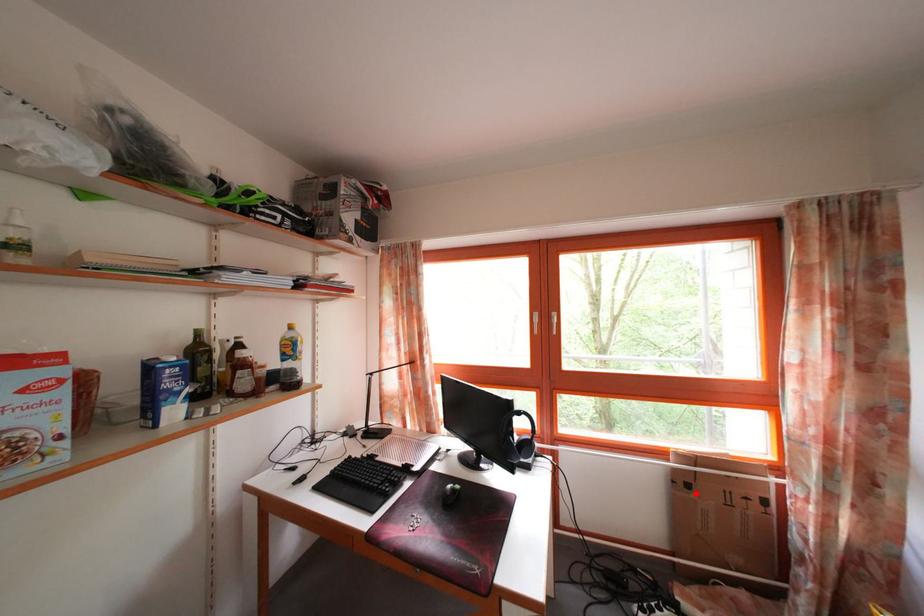
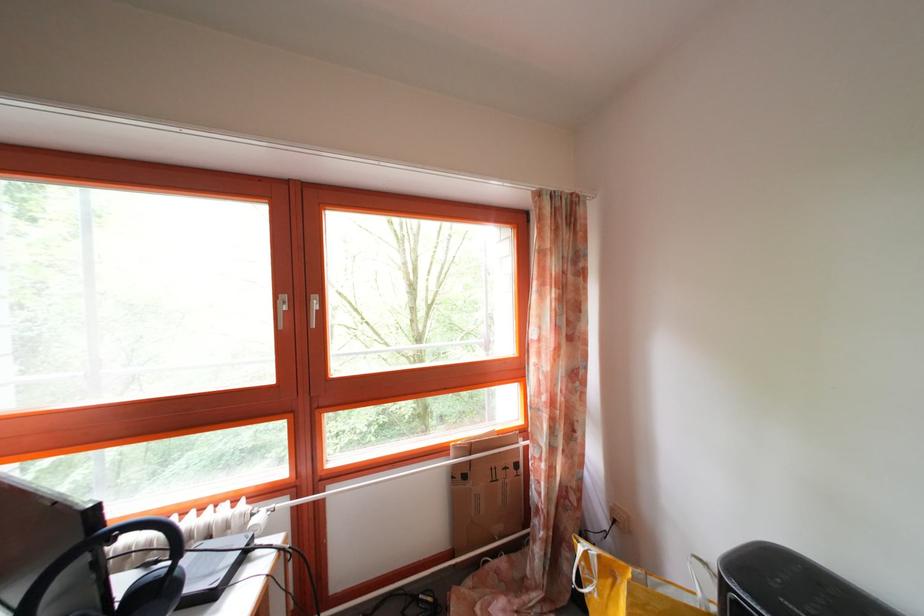
Where in the second image is the point corresponding to the highlighted location from the first image?

(472, 484)